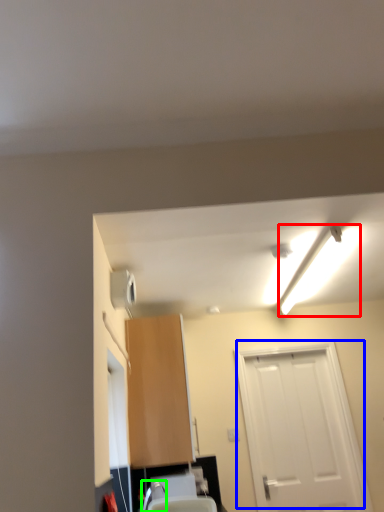
Question: Which is nearer to the light fixture (highlighted by a red box)? door (highlighted by a blue box) or faucet (highlighted by a green box).

Choices:
 (A) door
 (B) faucet

Answer: (A)